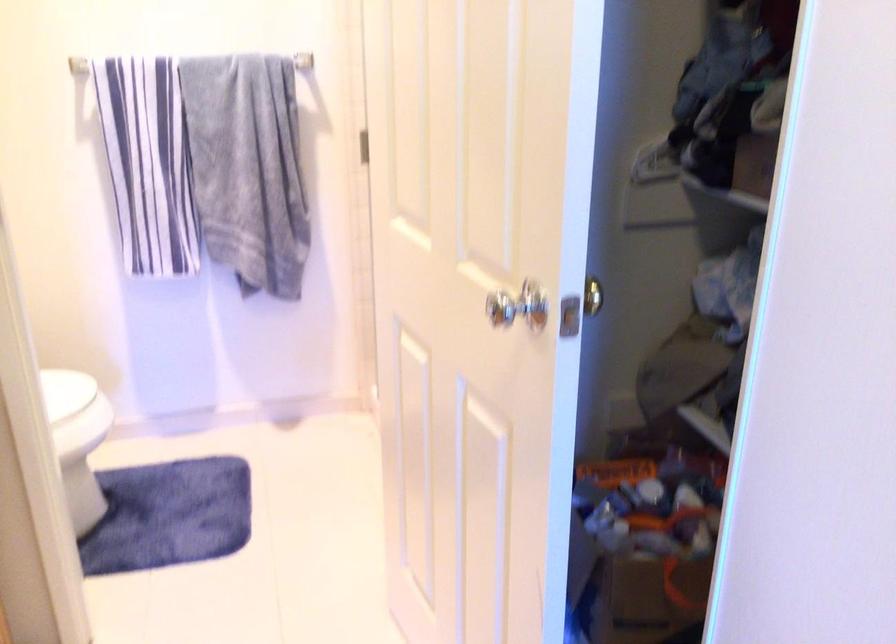
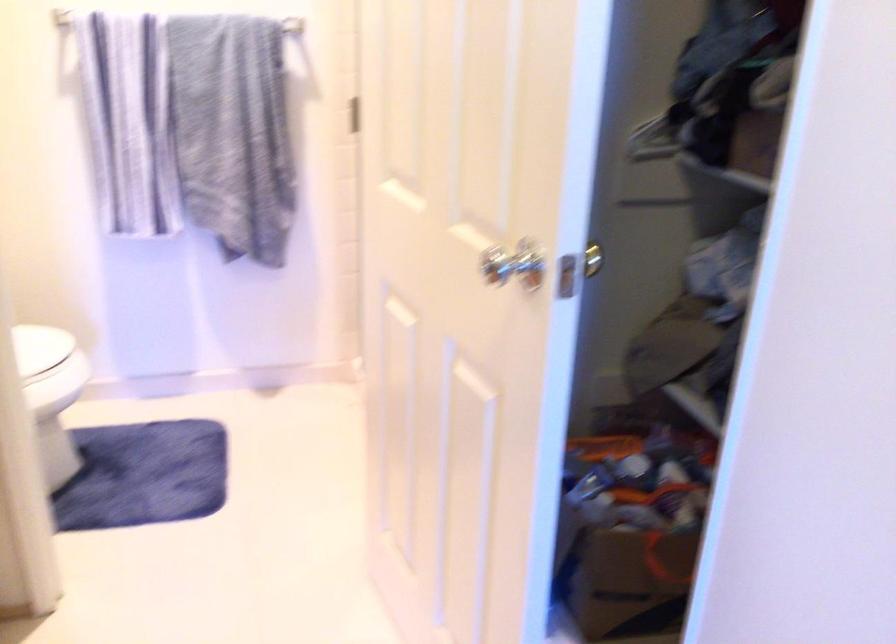
Question: The camera is either moving clockwise (left) or counter-clockwise (right) around the object. The first image is from the beginning of the video and the second image is from the end. Is the camera moving left or right when shooting the video?

Choices:
 (A) Left
 (B) Right

Answer: (A)